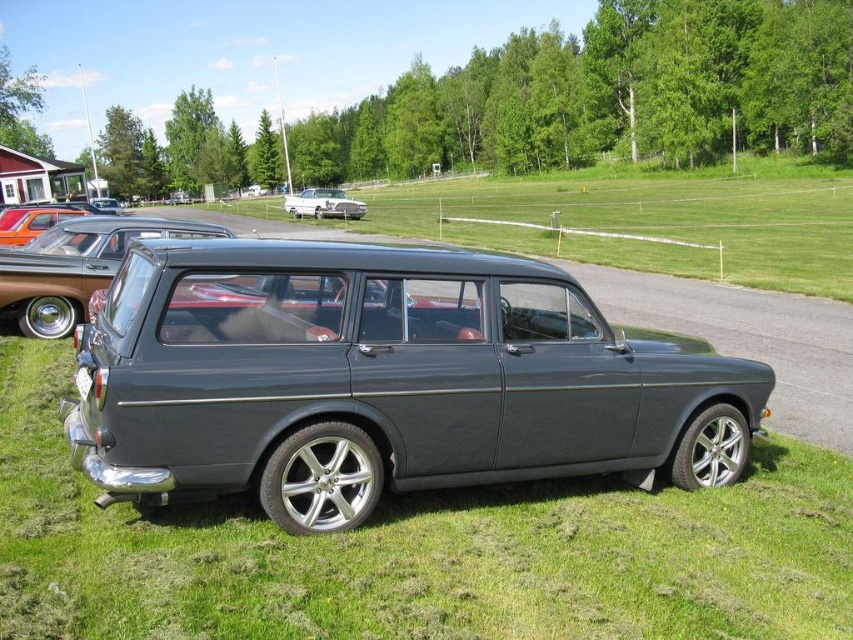
Consider the image. You are standing at the back of the vintage station wagon and want to walk to the front of the car. Which point, point (x=405, y=540) or point (x=334, y=193), would you pass through first?

Point (x=405, y=540) is in front of point (x=334, y=193), so you would pass through point (x=405, y=540) first when walking from the back to the front of the vintage station wagon.

You are a delivery driver who needs to park your truck between two vehicles in the image. The truck requires a minimum of 40 meters of space to maneuver. Can you safely park between the satin dark gray station wagon at center and the shiny silver sedan at center?

The distance between the satin dark gray station wagon at center and the shiny silver sedan at center is 36.65 meters, which is less than the required 40 meters. Therefore, you cannot safely park your truck between them.

Based on the photo, you are a photographer trying to capture both the metallic gray car at center and the orange metallic car at left in a single shot. Based on their positions, which car should you focus on first to ensure both are in frame?

You should focus on the metallic gray car at center first because it is in front of the orange metallic car at left, so adjusting the camera angle to include both would require framing around the front car first.